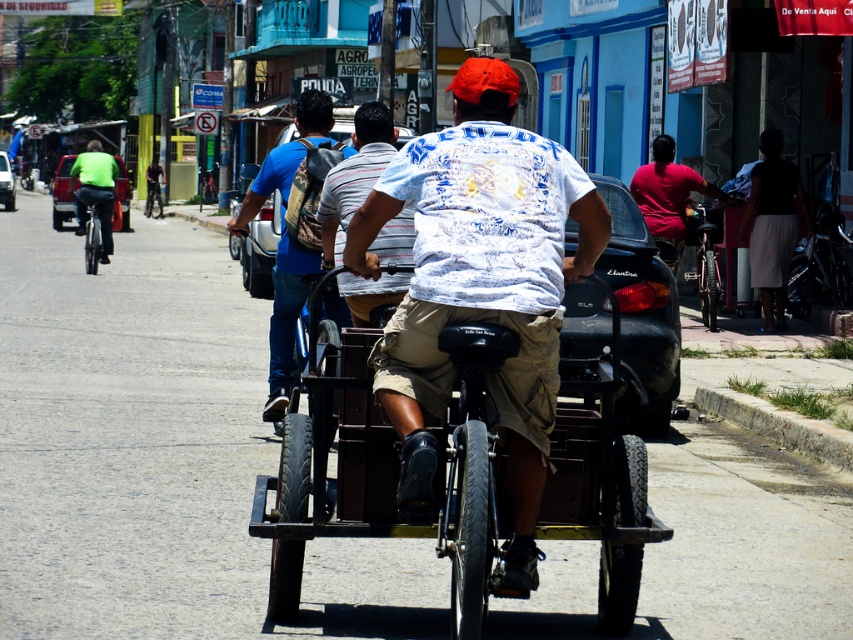
Question: Which point is farther to the camera?

Choices:
 (A) white printed shirt at center
 (B) metallic black rickshaw at center
 (C) red matte shirt at center
 (D) shiny silver bicycle at left

Answer: (D)

Question: From the image, what is the correct spatial relationship of blue denim jeans at center in relation to metallic silver bicycle at center?

Choices:
 (A) right
 (B) left

Answer: (A)

Question: Among these points, which one is farthest from the camera?

Choices:
 (A) (712, 288)
 (B) (660, 136)

Answer: (B)

Question: Can you confirm if metallic black rickshaw at center is positioned to the left of white printed shirt at center?

Choices:
 (A) no
 (B) yes

Answer: (A)

Question: Is red matte shirt at center to the left of metallic silver bicycle at center from the viewer's perspective?

Choices:
 (A) no
 (B) yes

Answer: (A)

Question: Based on their relative distances, which object is nearer to the red matte shirt at center?

Choices:
 (A) shiny metallic bicycle at right
 (B) blue denim jeans at center
 (C) metallic silver bicycle at center

Answer: (A)